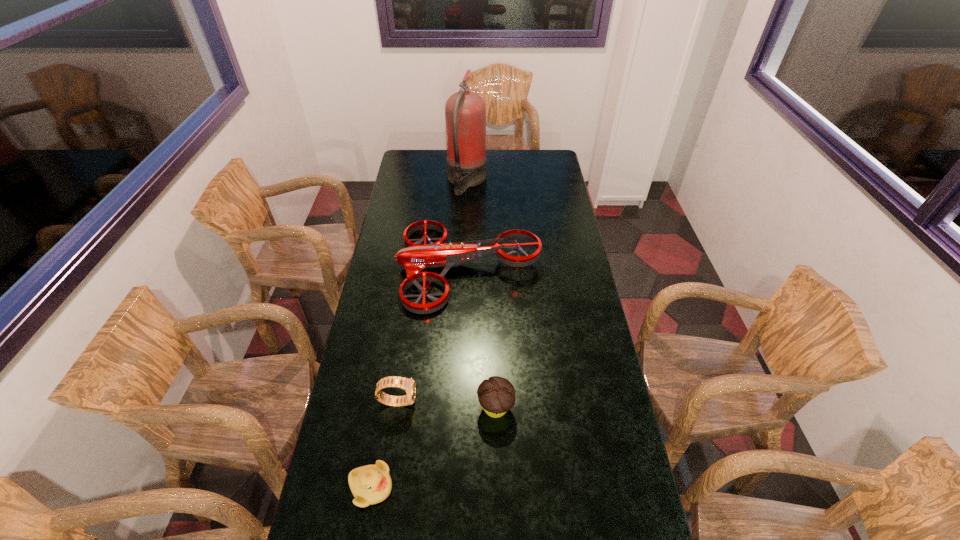
Where is `free point between the duckling and the muffin`? free point between the duckling and the muffin is located at coordinates pos(433,447).

Where is `free space between the duckling and the fire extinguisher`? This screenshot has width=960, height=540. free space between the duckling and the fire extinguisher is located at coordinates [419, 334].

At what (x,y) coordinates should I click in order to perform the action: click on free space between the muffin and the fourth nearest object. Please return your answer as a coordinate pair (x, y). Looking at the image, I should click on (482, 337).

Where is `empty location between the muffin and the nearest object`? The width and height of the screenshot is (960, 540). empty location between the muffin and the nearest object is located at coordinates (433, 447).

The width and height of the screenshot is (960, 540). I want to click on the second closest object to the muffin, so click(371, 484).

You are a GUI agent. You are given a task and a screenshot of the screen. Output one action in this format:
    pyautogui.click(x=<x>, y=<y>)
    Task: Click on the object that ranks as the second closest to the watch
    
    Given the screenshot: What is the action you would take?
    pyautogui.click(x=496, y=395)

At what (x,y) coordinates should I click in order to perform the action: click on free location that satisfies the following two spatial constraints: 1. at the nozzle of the fire extinguisher; 2. on the right side of the drone. Please return your answer as a coordinate pair (x, y). The image size is (960, 540). Looking at the image, I should click on (464, 267).

Where is `vacant space that satisfies the following two spatial constraints: 1. at the nozzle of the tallest object; 2. on the back side of the muffin`? The height and width of the screenshot is (540, 960). vacant space that satisfies the following two spatial constraints: 1. at the nozzle of the tallest object; 2. on the back side of the muffin is located at coordinates (458, 407).

Where is `vacant space that satisfies the following two spatial constraints: 1. on the front side of the fourth nearest object; 2. on the front-facing side of the shortest object`? The width and height of the screenshot is (960, 540). vacant space that satisfies the following two spatial constraints: 1. on the front side of the fourth nearest object; 2. on the front-facing side of the shortest object is located at coordinates (463, 487).